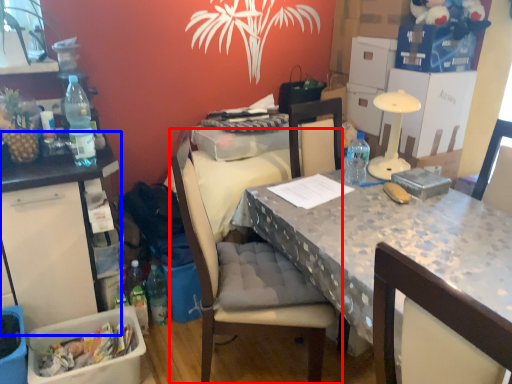
Question: Which point is closer to the camera, chair (highlighted by a red box) or table (highlighted by a blue box)?

Choices:
 (A) chair
 (B) table

Answer: (A)